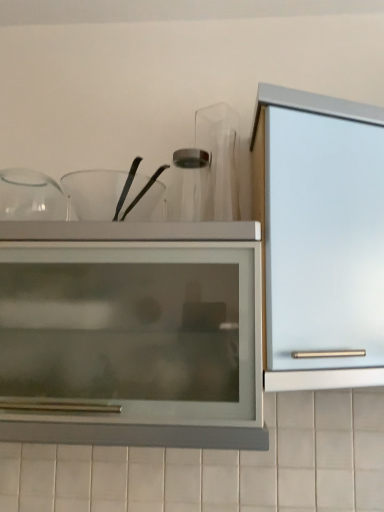
Question: Is matte glass cupboard at center wider or thinner than satin silver cabinet at right?

Choices:
 (A) wide
 (B) thin

Answer: (A)

Question: Considering their positions, is matte glass cupboard at center located in front of or behind satin silver cabinet at right?

Choices:
 (A) behind
 (B) front

Answer: (B)

Question: Based on their relative distances, which object is nearer to the satin silver cabinet at right?

Choices:
 (A) transparent glass bowls at upper center
 (B) matte glass cupboard at center

Answer: (B)

Question: Which of these objects is positioned farthest from the matte glass cupboard at center?

Choices:
 (A) transparent glass bowls at upper center
 (B) satin silver cabinet at right

Answer: (A)